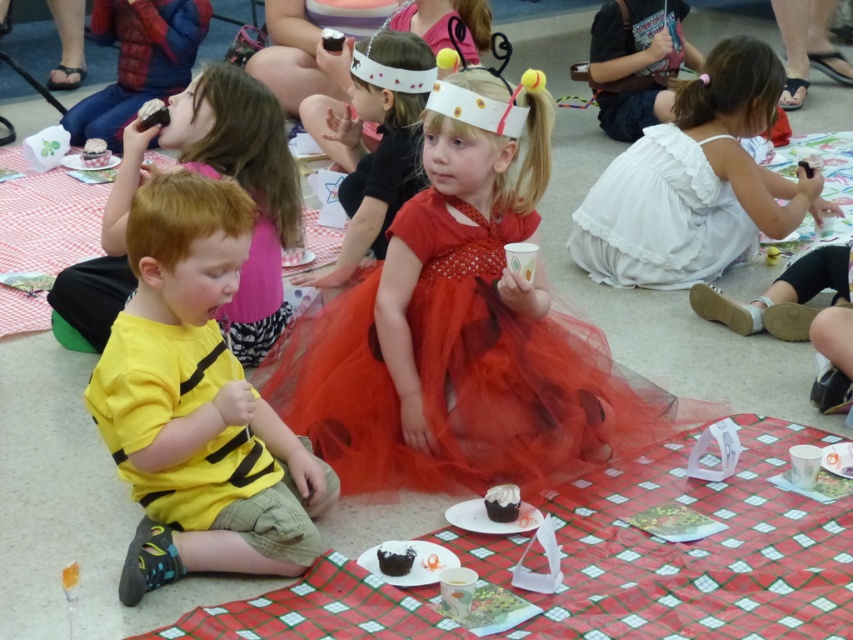
You are standing in the room and see two points marked in the image. Which point is closer to you, point [123,582] or point [392,568]?

Point [123,582] is closer to the viewer than point [392,568].

You are a photographer trying to capture a group photo of the children at the party. You want to ensure both the yellow cotton shirt at left and the white cotton dress at right are visible in the frame. Based on their positions, which child should be placed on the left side of the photo to maintain their original arrangement?

The yellow cotton shirt at left should be placed on the left side of the photo because it is already positioned on the left side of the white cotton dress at right in the original scene.

You are a photographer at the party and want to take a picture of both the white cotton dress at center and the chocolate cake at center. To ensure both are in frame, should you position the camera to the left or right of the two objects?

You should position the camera to the left of the white cotton dress at center and chocolate cake at center because the white cotton dress at center is to the right of the chocolate cake at center, so positioning the camera to the left would capture both in the frame.